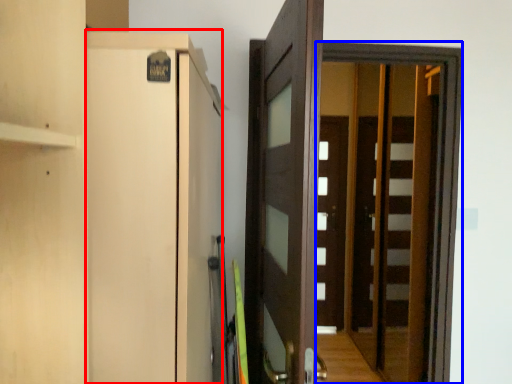
Question: Which point is further to the camera, cabinetry (highlighted by a red box) or screen door (highlighted by a blue box)?

Choices:
 (A) cabinetry
 (B) screen door

Answer: (B)